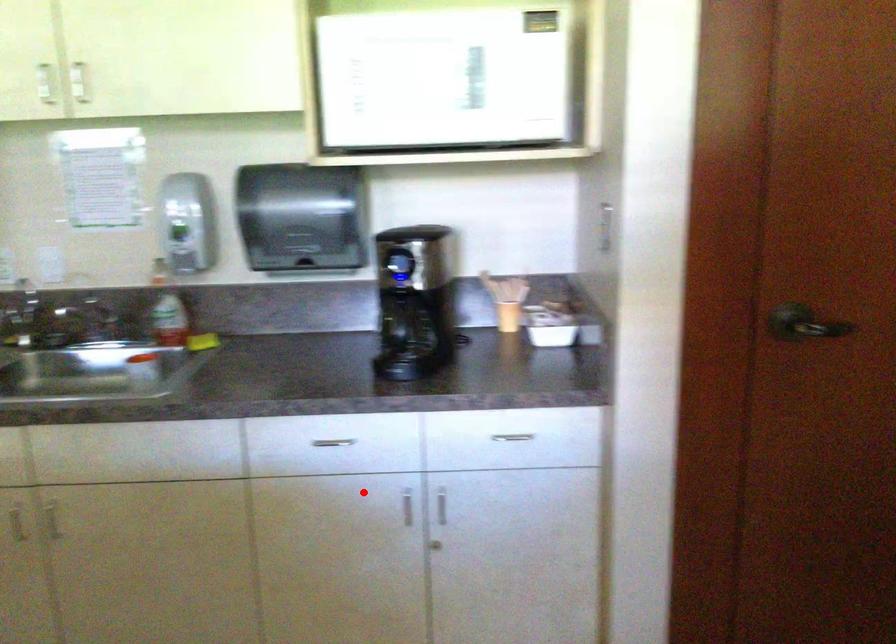
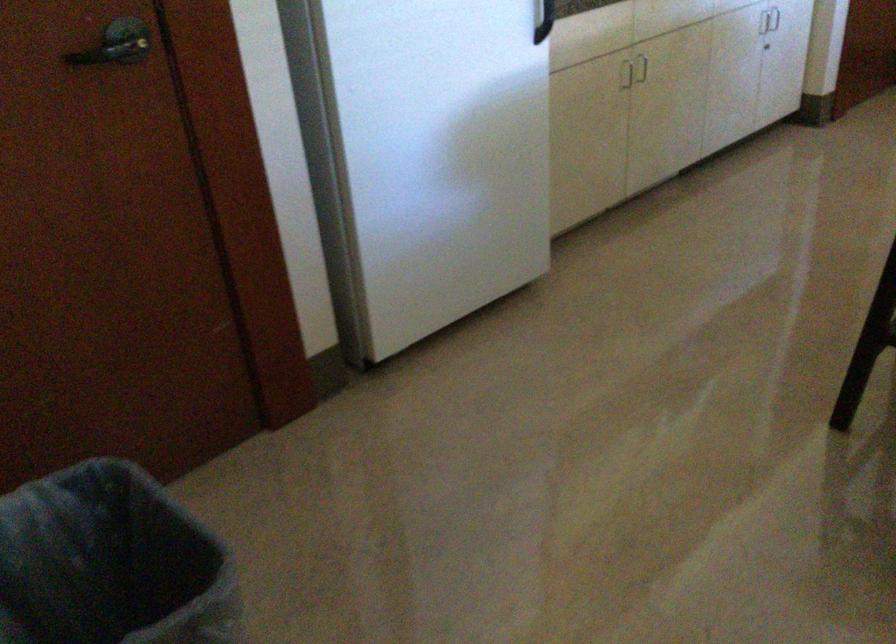
Question: I am providing you with two images of the same scene from different viewpoints. A red point is shown in image1. For the corresponding object point in image2, is it positioned nearer or farther from the camera?

Choices:
 (A) Nearer
 (B) Farther

Answer: (B)